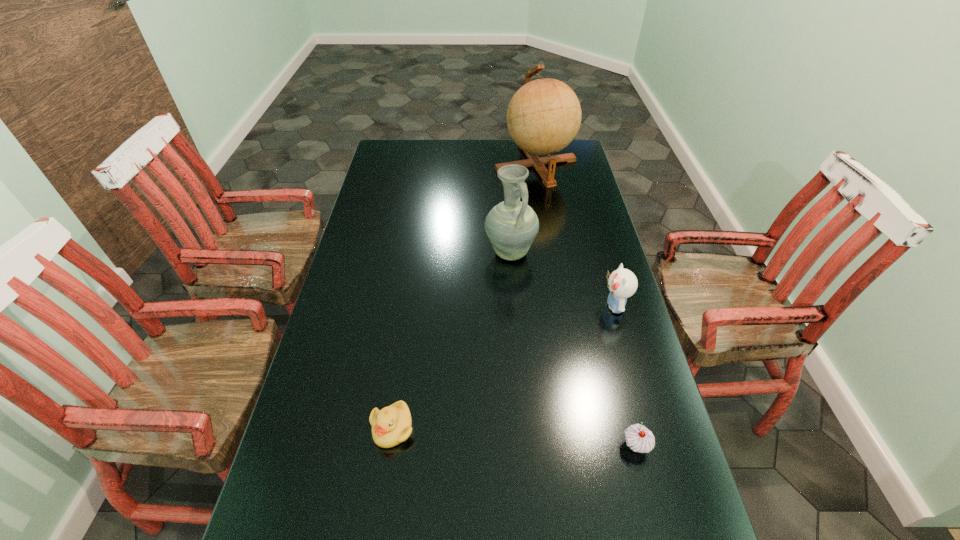
Where is `vacant area that lies between the cupcake and the second tallest object`? vacant area that lies between the cupcake and the second tallest object is located at coordinates pyautogui.click(x=573, y=349).

At what (x,y) coordinates should I click in order to perform the action: click on blank region between the cupcake and the tallest object. Please return your answer as a coordinate pair (x, y). Looking at the image, I should click on (586, 305).

This screenshot has height=540, width=960. I want to click on empty space between the shortest object and the fourth shortest object, so click(451, 340).

The width and height of the screenshot is (960, 540). I want to click on empty space between the shortest object and the pitcher, so click(451, 340).

The image size is (960, 540). Find the location of `vacant area between the pitcher and the fourth tallest object`. vacant area between the pitcher and the fourth tallest object is located at coordinates (573, 349).

Locate which object ranks in proximity to the third nearest object. Please provide its 2D coordinates. Your answer should be formatted as a tuple, i.e. [(x, y)], where the tuple contains the x and y coordinates of a point satisfying the conditions above.

[(512, 225)]

Find the location of a particular element. This screenshot has height=540, width=960. object that is the third nearest to the pitcher is located at coordinates (391, 425).

Identify the location of free spot that satisfies the following two spatial constraints: 1. on the front-facing side of the third nearest object; 2. on the front-facing side of the leftmost object. The height and width of the screenshot is (540, 960). (650, 428).